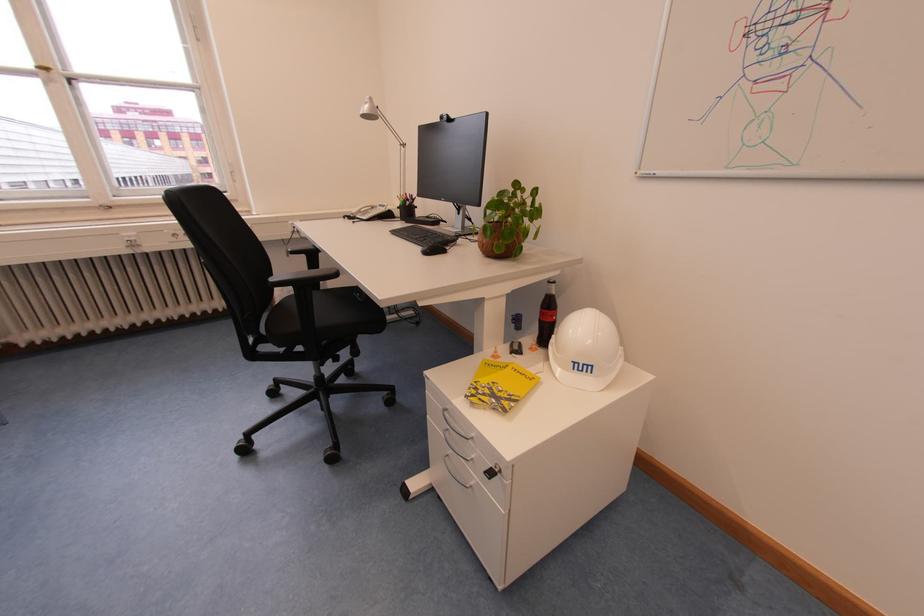
The location [509,221] corresponds to which object?

It corresponds to the woven plant pot in the image.